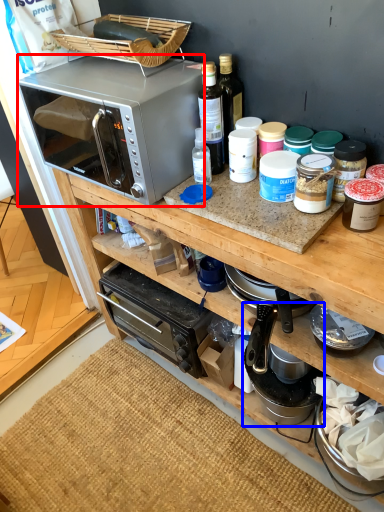
Question: Which point is closer to the camera, microwave oven (highlighted by a red box) or appliance (highlighted by a blue box)?

Choices:
 (A) microwave oven
 (B) appliance

Answer: (A)